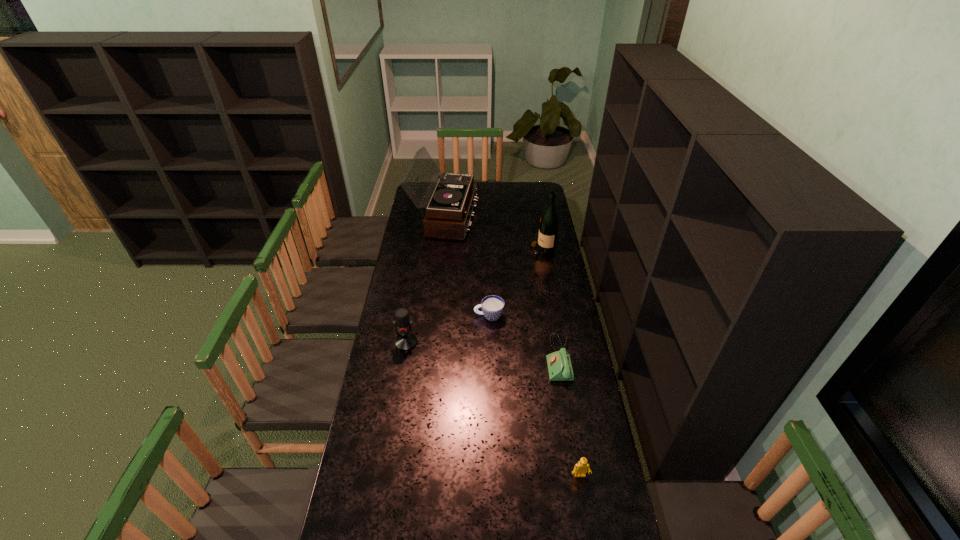
The height and width of the screenshot is (540, 960). In order to click on record player present at the left edge in this screenshot , I will do `click(448, 213)`.

Image resolution: width=960 pixels, height=540 pixels. In order to click on microphone that is at the left edge in this screenshot , I will do `click(405, 341)`.

In order to click on wine bottle situated at the right edge in this screenshot , I will do `click(548, 229)`.

The width and height of the screenshot is (960, 540). What are the coordinates of `Lego that is at the right edge` in the screenshot? It's located at (580, 468).

Identify the location of telephone that is positioned at the right edge. 559,365.

Where is `object that is at the far left corner`? The image size is (960, 540). object that is at the far left corner is located at coordinates (448, 213).

Where is `vacant space at the far edge of the desktop`? The image size is (960, 540). vacant space at the far edge of the desktop is located at coordinates (490, 181).

In the image, there is a desktop. Identify the location of vacant space at the left edge. The image size is (960, 540). (410, 227).

Find the location of a particular element. The image size is (960, 540). vacant space at the right edge is located at coordinates (566, 441).

The image size is (960, 540). What are the coordinates of `blank space at the far right corner` in the screenshot? It's located at (532, 198).